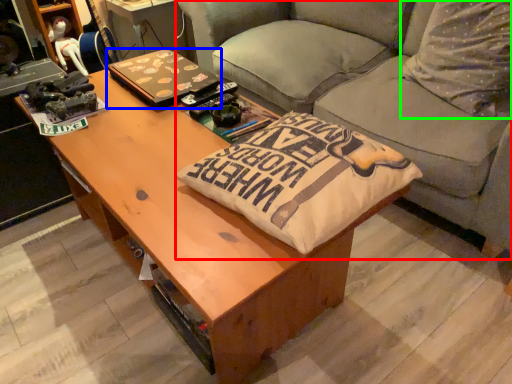
Question: Which object is the closest to the studio couch (highlighted by a red box)? Choose among these: laptop (highlighted by a blue box) or throw pillow (highlighted by a green box).

Choices:
 (A) laptop
 (B) throw pillow

Answer: (B)